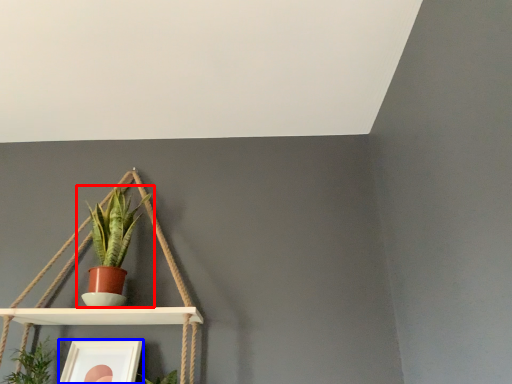
Question: Which object appears farthest to the camera in this image, houseplant (highlighted by a red box) or picture frame (highlighted by a blue box)?

Choices:
 (A) houseplant
 (B) picture frame

Answer: (A)